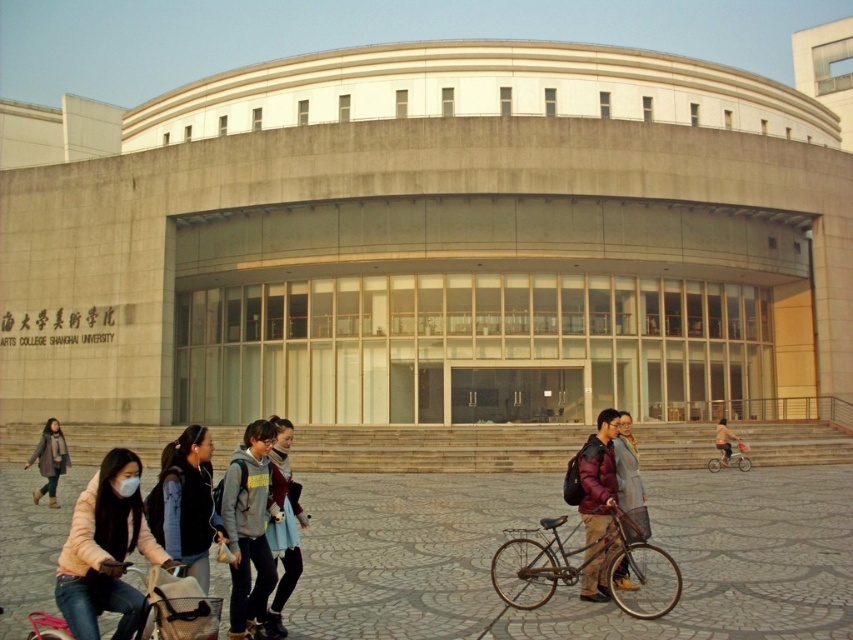
From the picture: Who is more forward, (590,499) or (631,449)?

Point (590,499) is more forward.

Between point (596, 531) and point (624, 502), which one is positioned behind?

Point (624, 502)

Is point (590, 460) positioned before point (624, 499)?

Yes, it is in front of point (624, 499).

Locate an element on the screen. This screenshot has height=640, width=853. maroon synthetic jacket at center is located at coordinates (598, 502).

Does point (73, 548) lie in front of point (672, 600)?

Yes, it is in front of point (672, 600).

Can you confirm if peachy fleece jacket at lower left is positioned to the left of rusty metal bicycle at lower center?

Indeed, peachy fleece jacket at lower left is positioned on the left side of rusty metal bicycle at lower center.

The height and width of the screenshot is (640, 853). What are the coordinates of `peachy fleece jacket at lower left` in the screenshot? It's located at (105, 550).

Where is `peachy fleece jacket at lower left`? peachy fleece jacket at lower left is located at coordinates (105, 550).

Who is higher up, rusty metal bicycle at lower center or metallic silver bicycle at lower right?

rusty metal bicycle at lower center is above.

Which is more to the left, rusty metal bicycle at lower center or metallic silver bicycle at lower right?

rusty metal bicycle at lower center is more to the left.

Where is `rusty metal bicycle at lower center`? rusty metal bicycle at lower center is located at coordinates (578, 566).